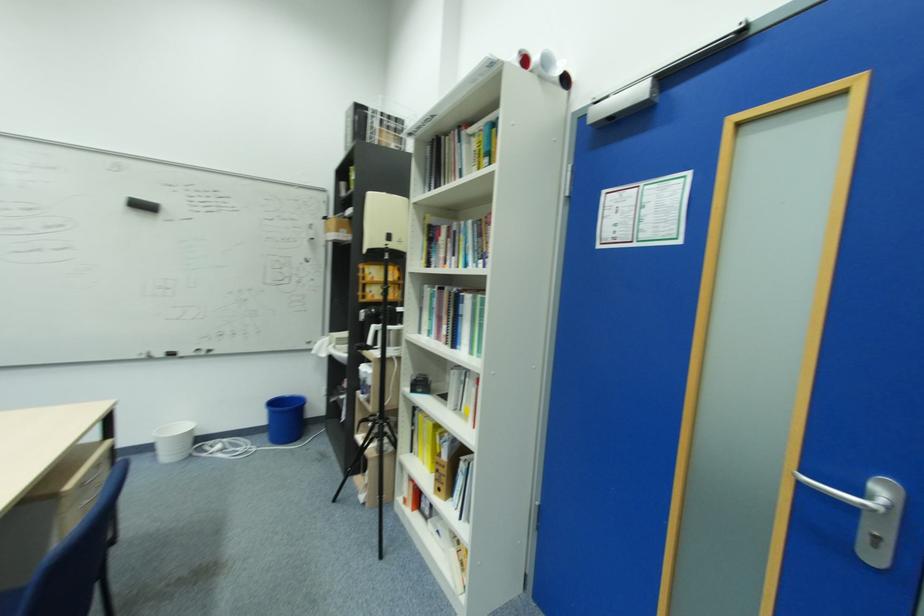
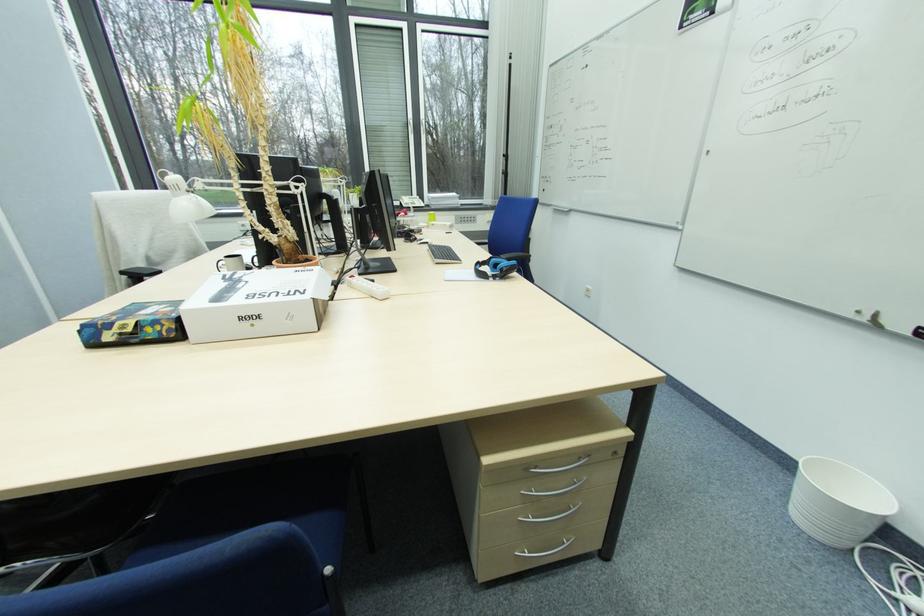
Find the pixel in the second image that matches (197,429) in the first image.

(885, 516)